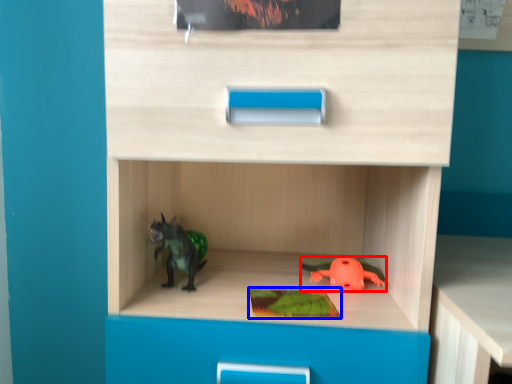
Question: Which object appears farthest to the camera in this image, toy (highlighted by a red box) or paperback book (highlighted by a blue box)?

Choices:
 (A) toy
 (B) paperback book

Answer: (A)